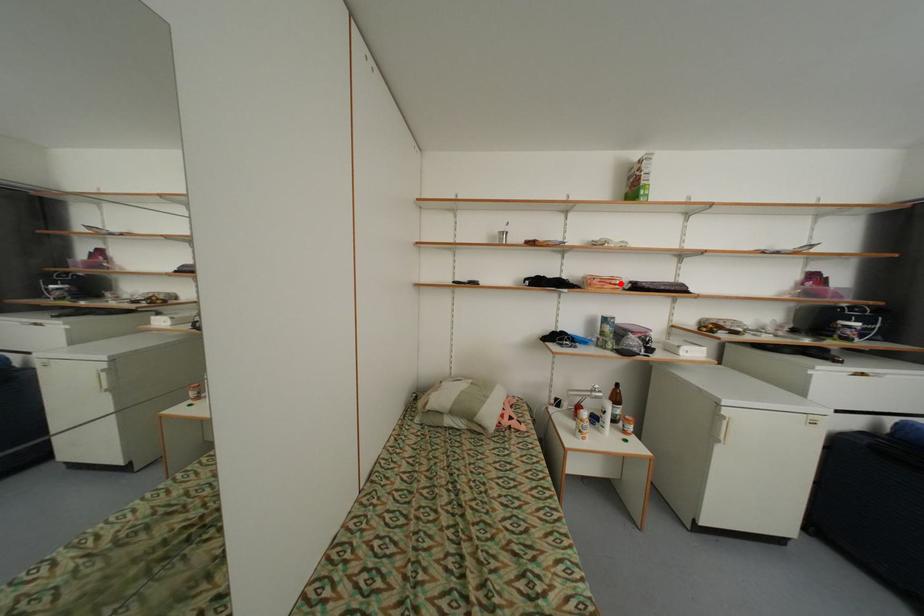
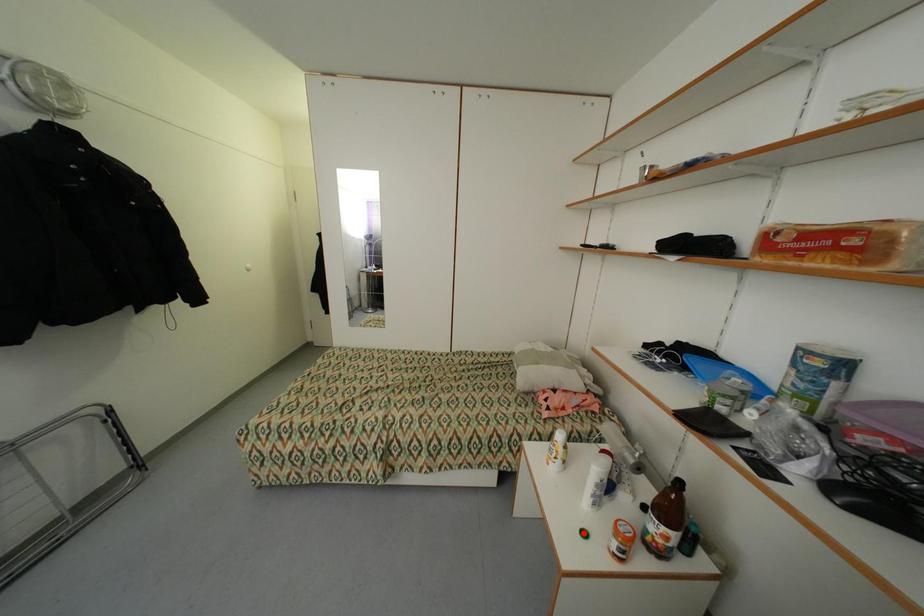
I am providing you with two images of the same scene from different viewpoints. A red point is marked on the first image and another point is marked on the second image. Do the highlighted points in image1 and image2 indicate the same real-world spot?

No